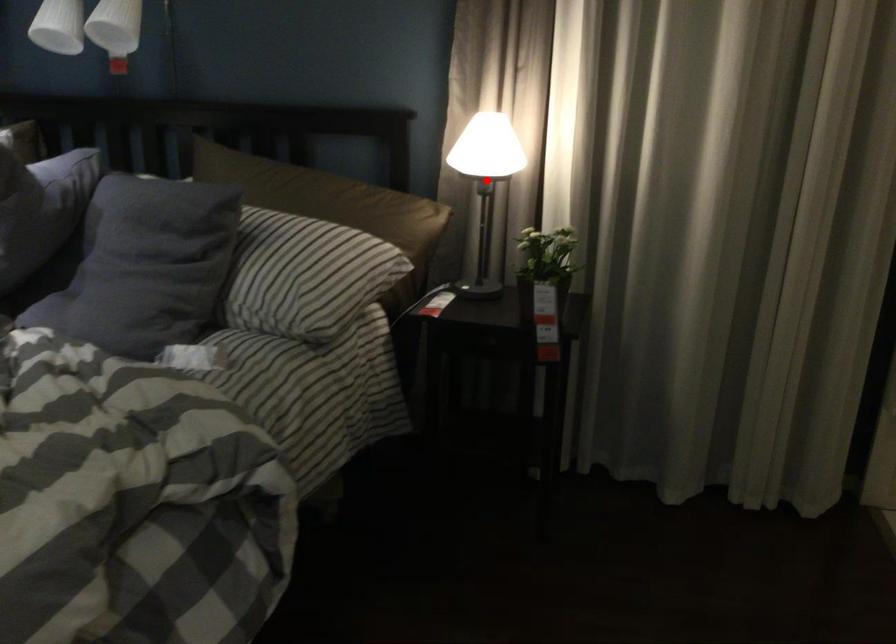
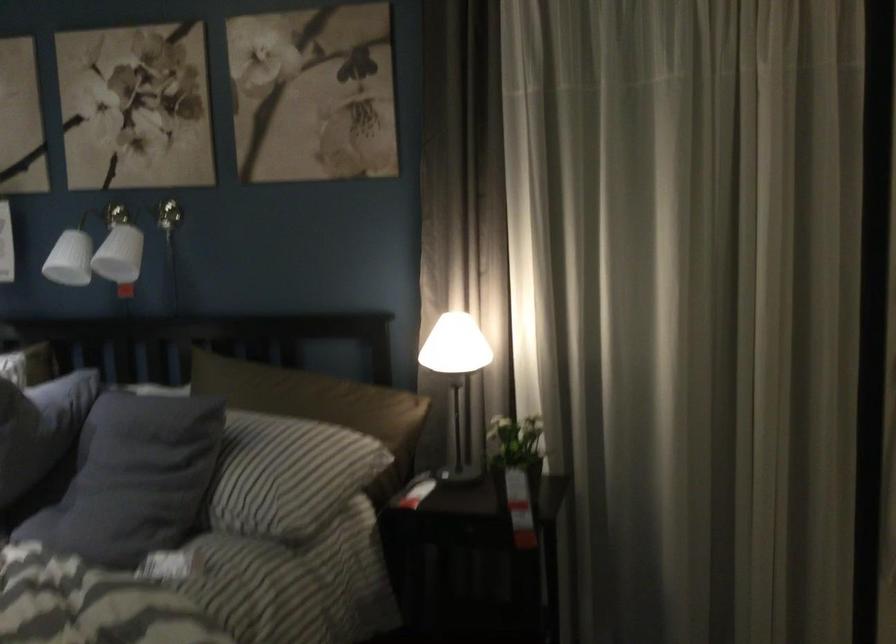
The point at the highlighted location is marked in the first image. Where is the corresponding point in the second image?

(455, 375)